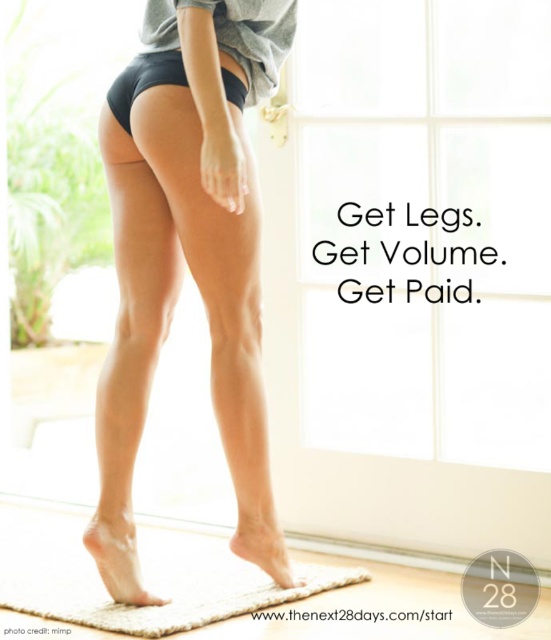
Does smooth matte black shorts at center come in front of black matte shorts at center?

That is True.

Is point (251, 180) in front of point (133, 65)?

Yes, point (251, 180) is closer to viewer.

Is point (234, 243) positioned in front of point (121, 99)?

Yes, it is in front of point (121, 99).

Find the location of `smooth matte black shorts at center`. smooth matte black shorts at center is located at coordinates (190, 259).

Is smooth matte black shorts at center shorter than matte black underwear at center?

Incorrect, smooth matte black shorts at center's height does not fall short of matte black underwear at center's.

Who is positioned more to the left, smooth matte black shorts at center or matte black underwear at center?

Positioned to the left is matte black underwear at center.

Between point (180, 237) and point (116, 128), which one is positioned in front?

Point (180, 237) is in front.

The width and height of the screenshot is (551, 640). What are the coordinates of `smooth matte black shorts at center` in the screenshot? It's located at (190, 259).

Identify the location of beige textured yoga mat at lower center. Image resolution: width=551 pixels, height=640 pixels. (143, 573).

Who is taller, beige textured yoga mat at lower center or black matte shorts at center?

Standing taller between the two is black matte shorts at center.

Is point (198, 561) positioned after point (142, 67)?

Yes.

Identify the location of beige textured yoga mat at lower center. The image size is (551, 640). (143, 573).